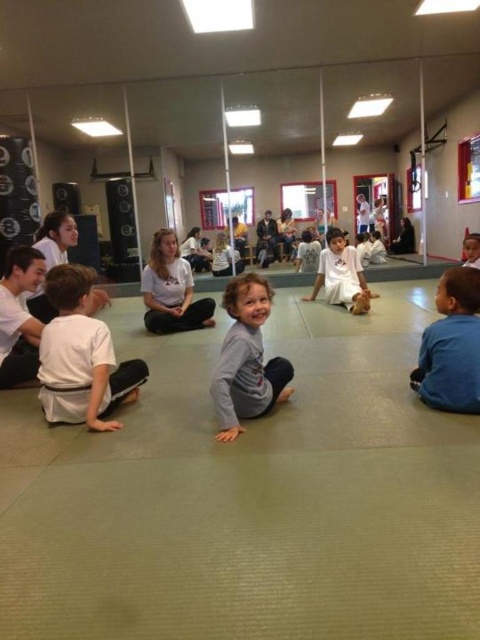
Question: Is gray soft shirt at center in front of white cotton pants at center?

Choices:
 (A) no
 (B) yes

Answer: (B)

Question: Which point is closer to the camera?

Choices:
 (A) blue cotton shirt at lower right
 (B) white cotton shirt at center

Answer: (A)

Question: Among these objects, which one is farthest from the camera?

Choices:
 (A) white cotton shirt at center
 (B) white cotton pants at center
 (C) white karate uniform at lower left
 (D) gray soft shirt at center

Answer: (B)

Question: Can you confirm if blue cotton shirt at lower right is positioned to the right of white cotton pants at center?

Choices:
 (A) yes
 (B) no

Answer: (B)

Question: In this image, where is gray soft shirt at center located relative to white cotton shirt at center?

Choices:
 (A) above
 (B) below

Answer: (B)

Question: Considering the real-world distances, which object is closest to the white karate uniform at lower left?

Choices:
 (A) gray soft shirt at center
 (B) blue cotton shirt at lower right

Answer: (A)